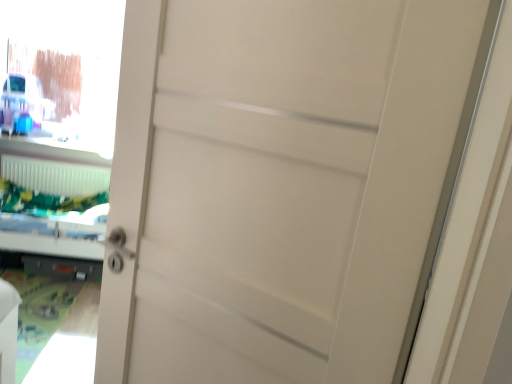
Question: Is white plastic radiator at lower left touching green fabric bed at left?

Choices:
 (A) no
 (B) yes

Answer: (A)

Question: Is white plastic radiator at lower left thinner than green fabric bed at left?

Choices:
 (A) no
 (B) yes

Answer: (B)

Question: From the image's perspective, is white plastic radiator at lower left above green fabric bed at left?

Choices:
 (A) yes
 (B) no

Answer: (A)

Question: Is white plastic radiator at lower left outside green fabric bed at left?

Choices:
 (A) yes
 (B) no

Answer: (A)

Question: Is there a large distance between white plastic radiator at lower left and green fabric bed at left?

Choices:
 (A) no
 (B) yes

Answer: (A)

Question: In the image, is white plastic radiator at lower left positioned in front of or behind transparent glass window screen at upper left?

Choices:
 (A) front
 (B) behind

Answer: (B)

Question: Does point (86, 185) appear closer or farther from the camera than point (54, 43)?

Choices:
 (A) farther
 (B) closer

Answer: (B)

Question: Is white plastic radiator at lower left inside the boundaries of transparent glass window screen at upper left, or outside?

Choices:
 (A) inside
 (B) outside

Answer: (B)

Question: Is white plastic radiator at lower left wider or thinner than transparent glass window screen at upper left?

Choices:
 (A) wide
 (B) thin

Answer: (A)

Question: Considering the positions of transparent glass window screen at upper left and green fabric bed at left in the image, is transparent glass window screen at upper left wider or thinner than green fabric bed at left?

Choices:
 (A) wide
 (B) thin

Answer: (B)

Question: From a real-world perspective, relative to green fabric bed at left, is transparent glass window screen at upper left vertically above or below?

Choices:
 (A) above
 (B) below

Answer: (A)

Question: Visually, is transparent glass window screen at upper left positioned to the left or to the right of green fabric bed at left?

Choices:
 (A) right
 (B) left

Answer: (B)

Question: Relative to green fabric bed at left, is transparent glass window screen at upper left in front or behind?

Choices:
 (A) front
 (B) behind

Answer: (B)

Question: Considering the positions of point pyautogui.click(x=60, y=185) and point pyautogui.click(x=90, y=188), is point pyautogui.click(x=60, y=185) closer or farther from the camera than point pyautogui.click(x=90, y=188)?

Choices:
 (A) closer
 (B) farther

Answer: (A)

Question: Is green fabric bed at left wider or thinner than white plastic radiator at lower left?

Choices:
 (A) wide
 (B) thin

Answer: (A)